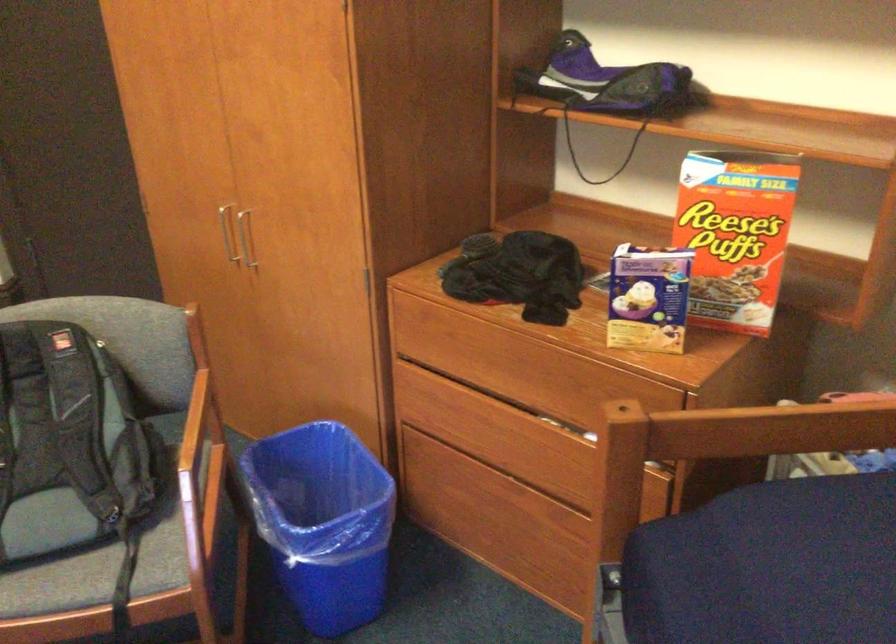
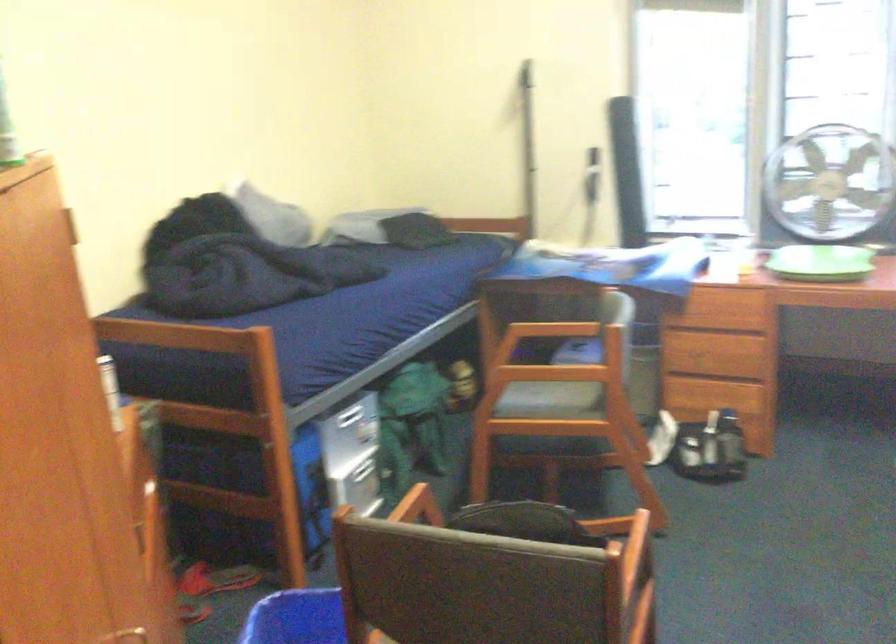
Find the pixel in the second image that matches (352,549) in the first image.

(297, 618)